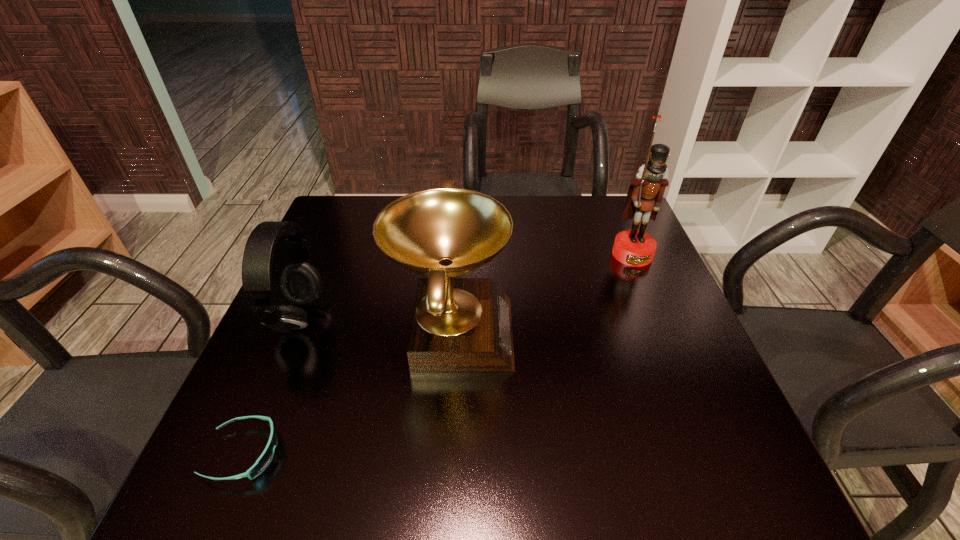
Where is `vacant region between the farthest object and the second object from right to left`? Image resolution: width=960 pixels, height=540 pixels. vacant region between the farthest object and the second object from right to left is located at coordinates (542, 293).

Where is `free space between the award and the tallest object`? free space between the award and the tallest object is located at coordinates (542, 293).

Where is `object that can be found as the second closest to the nearest object`? The width and height of the screenshot is (960, 540). object that can be found as the second closest to the nearest object is located at coordinates (458, 324).

Select which object appears as the closest to the second object from right to left. Please provide its 2D coordinates. Your answer should be formatted as a tuple, i.e. [(x, y)], where the tuple contains the x and y coordinates of a point satisfying the conditions above.

[(263, 461)]

At what (x,y) coordinates should I click in order to perform the action: click on vacant position in the image that satisfies the following two spatial constraints: 1. on the front-facing side of the tallest object; 2. on the ear cups of the earphone. Please return your answer as a coordinate pair (x, y). This screenshot has height=540, width=960. Looking at the image, I should click on (660, 319).

Find the location of a particular element. vacant region that satisfies the following two spatial constraints: 1. on the front-facing side of the tallest object; 2. on the ear cups of the earphone is located at coordinates (660, 319).

Where is `free spot that satisfies the following two spatial constraints: 1. on the front-facing side of the tallest object; 2. on the ear cups of the earphone`? The image size is (960, 540). free spot that satisfies the following two spatial constraints: 1. on the front-facing side of the tallest object; 2. on the ear cups of the earphone is located at coordinates (660, 319).

Where is `vacant position in the image that satisfies the following two spatial constraints: 1. on the front-facing side of the farthest object; 2. on the ear cups of the third tallest object`? The width and height of the screenshot is (960, 540). vacant position in the image that satisfies the following two spatial constraints: 1. on the front-facing side of the farthest object; 2. on the ear cups of the third tallest object is located at coordinates (660, 319).